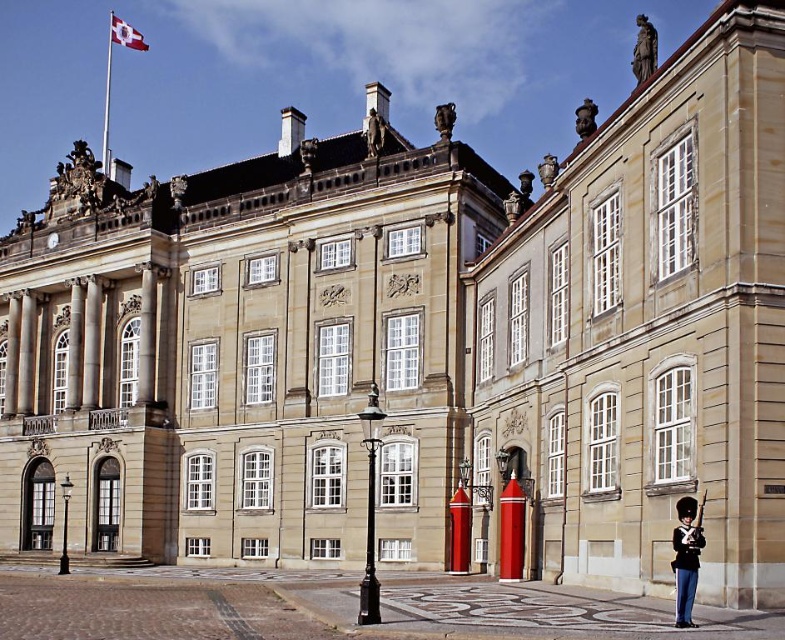
Question: Considering the real-world distances, which object is farthest from the matte stone building at right?

Choices:
 (A) dark blue uniform at lower right
 (B) white fabric flag at upper left
 (C) polished bronze statue at upper right

Answer: (B)

Question: Estimate the real-world distances between objects in this image. Which object is closer to the polished bronze statue at upper right?

Choices:
 (A) dark blue uniform at lower right
 (B) white fabric flag at upper left

Answer: (A)

Question: Among these points, which one is nearest to the camera?

Choices:
 (A) (681, 524)
 (B) (577, 580)
 (C) (155, 538)
 (D) (123, 26)

Answer: (A)

Question: Can you confirm if dark blue uniform at lower right is positioned to the left of polished bronze statue at upper right?

Choices:
 (A) no
 (B) yes

Answer: (B)

Question: Can you confirm if matte stone building at right is positioned below polished bronze statue at upper right?

Choices:
 (A) no
 (B) yes

Answer: (B)

Question: Is smooth stone building at center bigger than polished bronze statue at upper right?

Choices:
 (A) no
 (B) yes

Answer: (A)